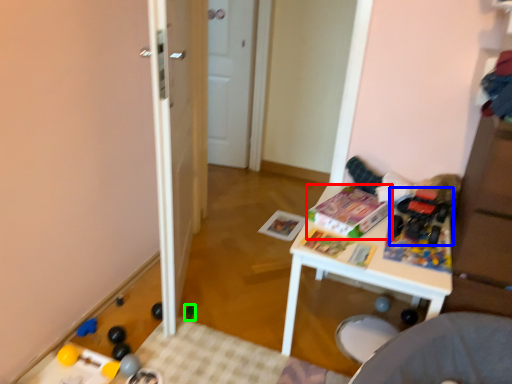
Question: Estimate the real-world distances between objects in this image. Which object is closer to magazine (highlighted by a red box), toy (highlighted by a blue box) or toy (highlighted by a green box)?

Choices:
 (A) toy
 (B) toy

Answer: (A)